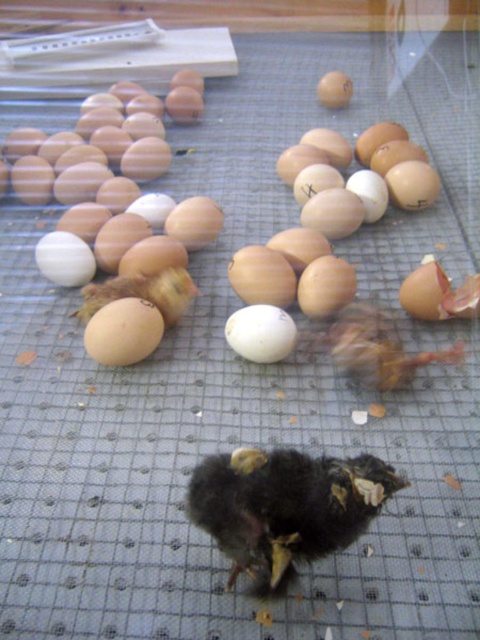
You are observing an incubation setup from above. There are two points marked on the heat mat surface at coordinates point (291,481) and point (191,289). Which point is closer to your viewpoint?

Point (291,481) is closer to the camera than point (191,289).

You are a small black chick with a yellow beak and feet standing at point (113,109). You want to move to point (128,342). Is the path between these two points clear of any obstacles?

Point (113,109) is further to the viewer than point (128,342). Since the chick is at the closer point, it can move towards the farther point without obstacles as there are no objects mentioned between them in the scene description.